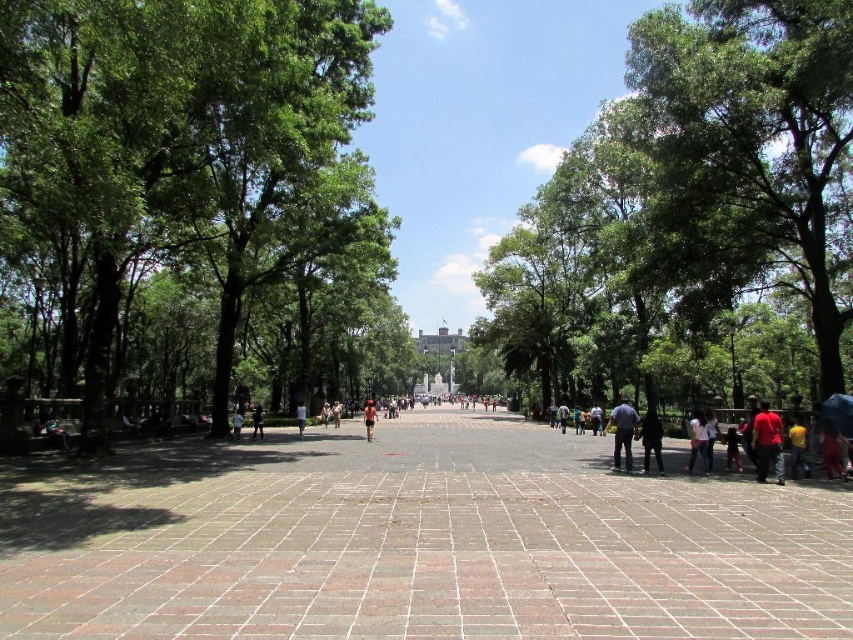
You are standing in the plaza and see the brown brick pavement at center and the red fabric pants at lower right. Which object appears taller in the image?

The brown brick pavement at center appears taller than the red fabric pants at lower right.

You are standing in the plaza and want to pick up both the red matte shirt at lower right and the white cotton shirt at center. Which shirt should you pick up first to follow the shortest path?

You should pick up the red matte shirt at lower right first because it is closer to you than the white cotton shirt at center.